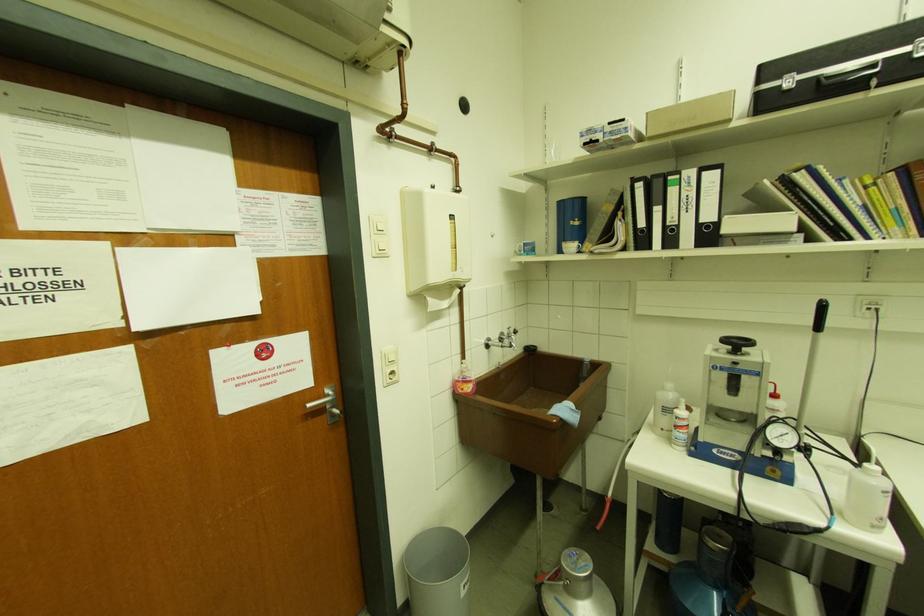
The height and width of the screenshot is (616, 924). Find the location of `soap dispenser pump`. soap dispenser pump is located at coordinates [x=772, y=391].